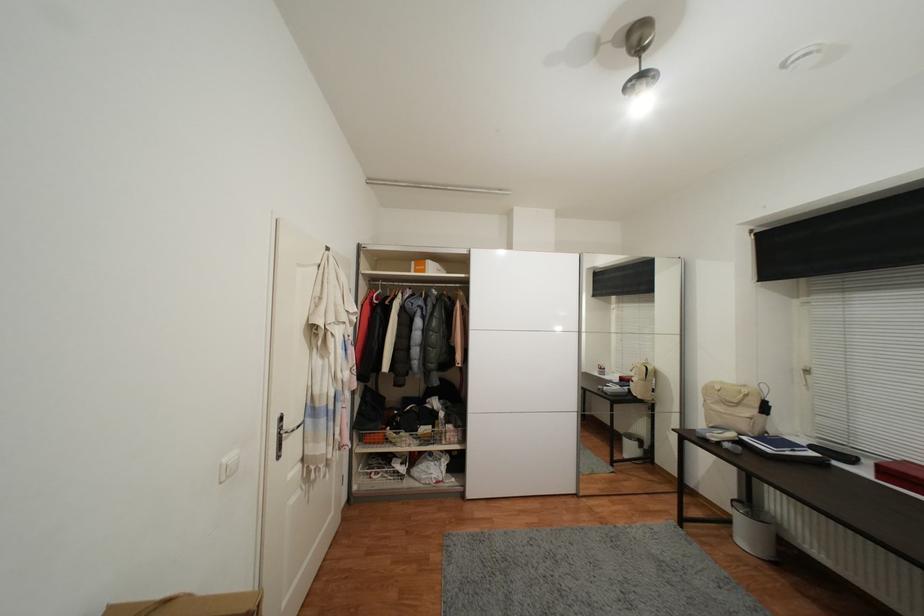
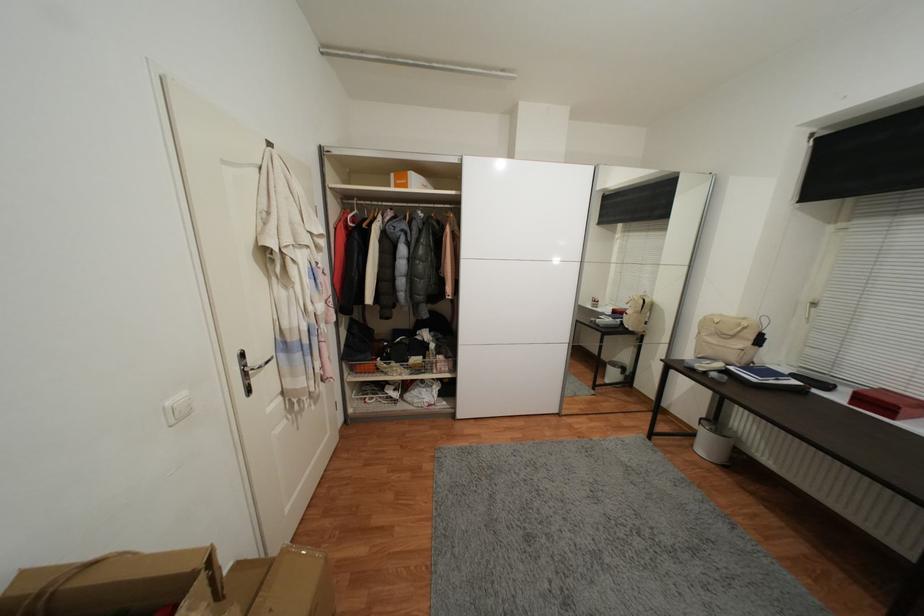
Locate, in the second image, the point that corresponds to point (233, 475) in the first image.

(186, 416)